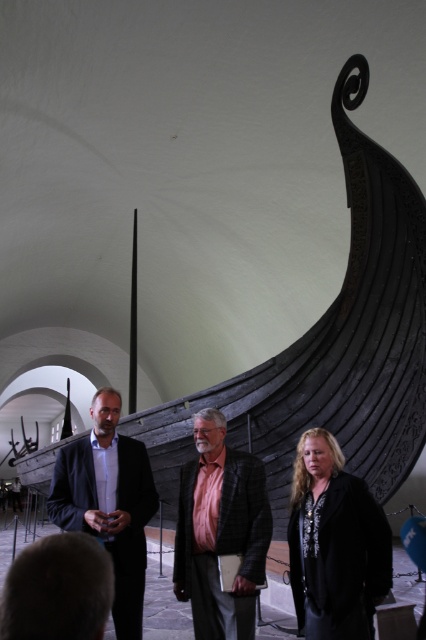
Can you confirm if black textured jacket at center is positioned to the right of pink textured shirt at center?

Correct, you'll find black textured jacket at center to the right of pink textured shirt at center.

The image size is (426, 640). What are the coordinates of `black textured jacket at center` in the screenshot? It's located at (334, 545).

Does black textured jacket at center appear on the right side of matte black suit at center?

Yes, black textured jacket at center is to the right of matte black suit at center.

Measure the distance between point (x=351, y=602) and camera.

A distance of 22.83 feet exists between point (x=351, y=602) and camera.

Is point (316, 442) closer to viewer compared to point (120, 502)?

Yes.

Where is `black textured jacket at center`? The width and height of the screenshot is (426, 640). black textured jacket at center is located at coordinates (334, 545).

Can you confirm if pink textured shirt at center is thinner than matte black suit at center?

Yes.

Can you confirm if pink textured shirt at center is positioned to the left of matte black suit at center?

Incorrect, pink textured shirt at center is not on the left side of matte black suit at center.

Is point (215, 509) farther from viewer compared to point (98, 436)?

No, (215, 509) is in front of (98, 436).

This screenshot has height=640, width=426. I want to click on pink textured shirt at center, so click(219, 531).